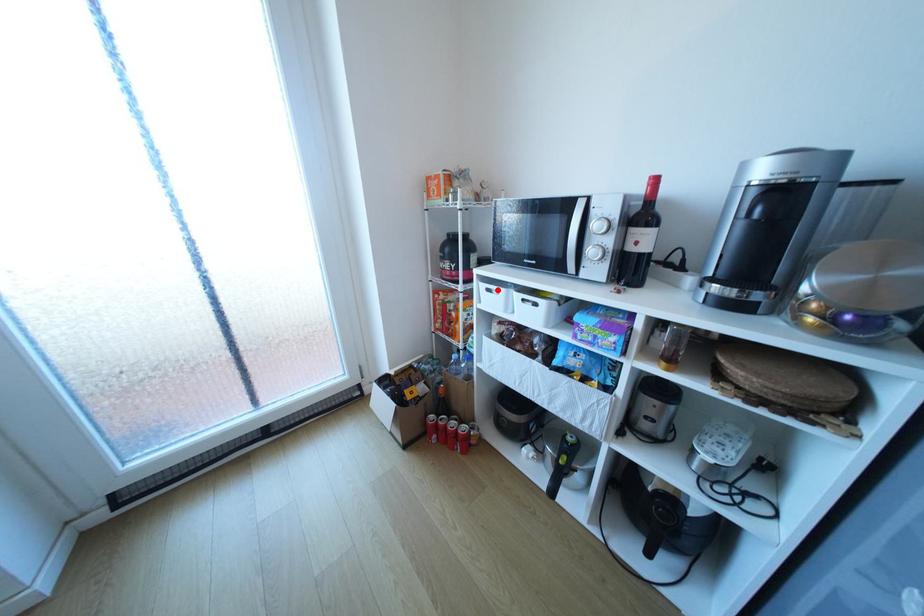
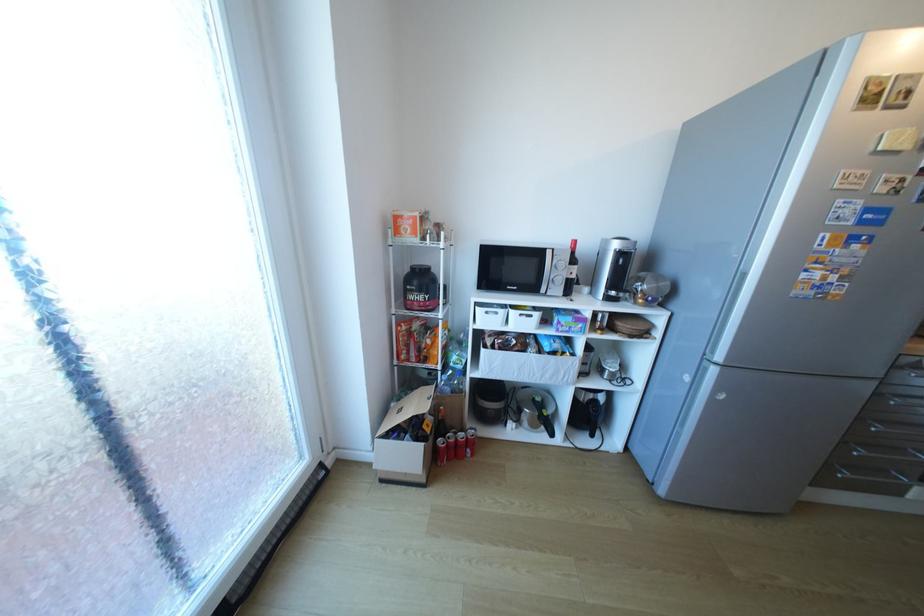
Find the pixel in the second image that matches the highlighted location in the first image.

(495, 313)